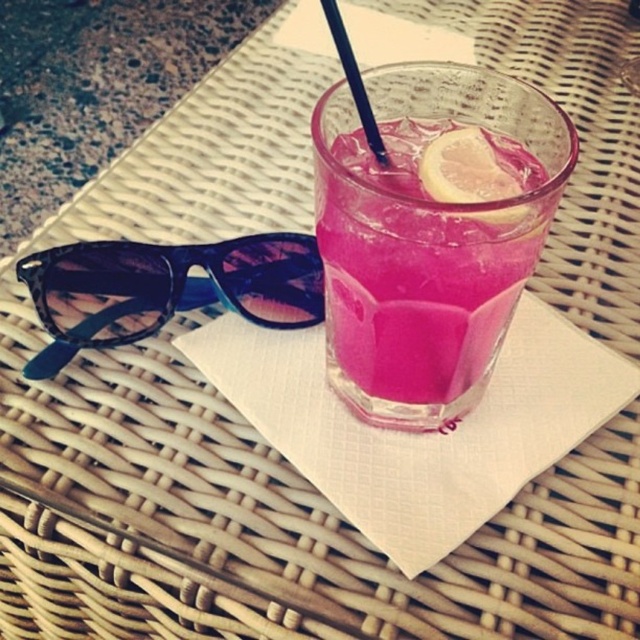
You are at a beachside cafe and want to grab the transparent plastic straw at upper center without moving the pink glass at center. Can you reach it easily?

The transparent plastic straw at upper center is to the left of the pink glass at center, so you can reach it easily without disturbing the glass.